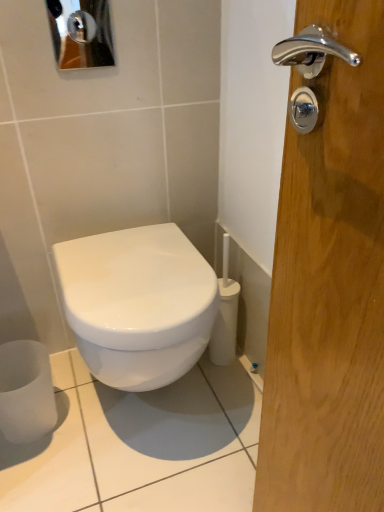
Locate an element on the screen. The width and height of the screenshot is (384, 512). empty space that is ontop of white glossy toilet at center (from a real-world perspective) is located at coordinates (132, 261).